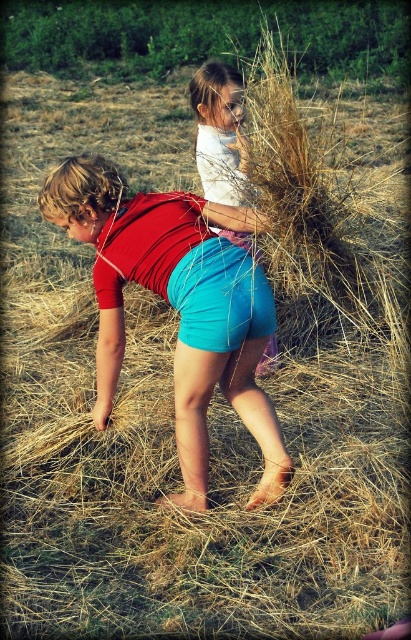
You are a parent trying to locate your child in a park. You see two children in the park, one wearing teal fabric shorts at center and the other wearing matte white shirt at upper center. Which child is closer to you?

The teal fabric shorts at center is closer to you than matte white shirt at upper center because the distance between them is 17.67 inches, meaning the teal fabric shorts at center is nearer.

You are a photographer trying to capture a candid shot of the two children. You notice the teal fabric shorts at center and the matte white shirt at upper center in your viewfinder. Which object should you focus on first if you want to ensure both are in sharp focus?

The teal fabric shorts at center is located below the matte white shirt at upper center. To ensure both are in sharp focus, you should focus on the matte white shirt at upper center first since it is closer to the camera, and the shorts will naturally fall within the depth of field when focusing on the upper object.

You are a photographer trying to capture both children in a single shot. Since the children are moving, you need to focus on their positions. Based on the scene, which child wearing the matte blue shorts at center is positioned to the left of the teal fabric shorts at center?

The matte blue shorts at center is to the left of teal fabric shorts at center, so the child wearing the matte blue shorts at center is positioned to the left of the child wearing the teal fabric shorts at center.